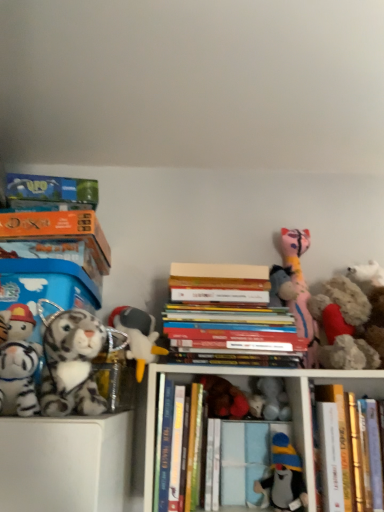
At what (x,y) coordinates should I click in order to perform the action: click on velvet plush bear at center, arranged as the sixth toy when viewed from the right. Please return your answer as a coordinate pair (x, y). Looking at the image, I should click on (224, 398).

Find the location of `white plush toy at center-left, the 3th toy when ordered from left to right`. white plush toy at center-left, the 3th toy when ordered from left to right is located at coordinates (137, 336).

Identify the location of white plush tiger at left, which appears as the ninth toy when viewed from the right. Image resolution: width=384 pixels, height=512 pixels. (18, 362).

Locate an element on the screen. The height and width of the screenshot is (512, 384). white plush toy at center, the 5th toy in the left-to-right sequence is located at coordinates (274, 399).

The height and width of the screenshot is (512, 384). Describe the element at coordinates (74, 361) in the screenshot. I see `white plush tiger at left, acting as the eighth toy starting from the right` at that location.

Describe the element at coordinates (289, 401) in the screenshot. I see `hardcover books at center` at that location.

Locate an element on the screen. This screenshot has height=512, width=384. velvet plush bear at center, the 4th toy in the left-to-right sequence is located at coordinates (224, 398).

Is hardcover books at center, which ranks as the 2th book in right-to-left order, inside or outside of fluffy beige stuffed animal at right, the eighth toy when ordered from left to right?

The correct answer is: outside.

Can you tell me how much hardcover books at center, which appears as the third book when viewed from the left, and fluffy beige stuffed animal at right, the eighth toy when ordered from left to right, differ in facing direction?

0.341 degrees separate the facing orientations of hardcover books at center, which appears as the third book when viewed from the left, and fluffy beige stuffed animal at right, the eighth toy when ordered from left to right.

Does hardcover books at center, which appears as the third book when viewed from the left, turn towards fluffy beige stuffed animal at right, the eighth toy when ordered from left to right?

No, hardcover books at center, which appears as the third book when viewed from the left, is not facing towards fluffy beige stuffed animal at right, the eighth toy when ordered from left to right.

From a real-world perspective, between hardcover books at center, which appears as the third book when viewed from the left, and fluffy beige stuffed animal at right, the eighth toy when ordered from left to right, who is vertically higher?

From a 3D spatial view, fluffy beige stuffed animal at right, the eighth toy when ordered from left to right, is above.

From a real-world perspective, which object rests below the other?

hardcover book at center, positioned as the first book in right-to-left order, from a real-world perspective.

How different are the orientations of hardcover book at center, positioned as the first book in right-to-left order, and fluffy white teddy bear at right, the 1th toy when ordered from right to left, in degrees?

→ The angular difference between hardcover book at center, positioned as the first book in right-to-left order, and fluffy white teddy bear at right, the 1th toy when ordered from right to left, is 0.341 degrees.

How much distance is there between hardcover book at center, which is counted as the fourth book, starting from the left, and fluffy white teddy bear at right, placed as the 9th toy when sorted from left to right?

hardcover book at center, which is counted as the fourth book, starting from the left, is 19.68 centimeters from fluffy white teddy bear at right, placed as the 9th toy when sorted from left to right.

Which point is more forward, (342,431) or (376,303)?

Point (342,431)

Image resolution: width=384 pixels, height=512 pixels. I want to click on the 5th toy above the soft plush penguin at center, which is the 4th toy in right-to-left order (from a real-world perspective), so click(137, 336).

Would you consider white plush toy at center-left, the 3th toy when ordered from left to right, to be distant from soft plush penguin at center, the sixth toy viewed from the left?

white plush toy at center-left, the 3th toy when ordered from left to right, is actually quite close to soft plush penguin at center, the sixth toy viewed from the left.

Is white plush toy at center-left, acting as the seventh toy starting from the right, spatially inside soft plush penguin at center, which is the 4th toy in right-to-left order, or outside of it?

The correct answer is: outside.

Considering the relative sizes of velvet plush bear at center, arranged as the sixth toy when viewed from the right, and hardcover books at center, which ranks as the 2th book in right-to-left order, in the image provided, is velvet plush bear at center, arranged as the sixth toy when viewed from the right, smaller than hardcover books at center, which ranks as the 2th book in right-to-left order,?

Yes.

Is velvet plush bear at center, arranged as the sixth toy when viewed from the right, not near hardcover books at center, which ranks as the 2th book in right-to-left order?

Actually, velvet plush bear at center, arranged as the sixth toy when viewed from the right, and hardcover books at center, which ranks as the 2th book in right-to-left order, are a little close together.

From the image's perspective, who appears lower, velvet plush bear at center, the 4th toy in the left-to-right sequence, or hardcover books at center, which ranks as the 2th book in right-to-left order?

From the image's view, velvet plush bear at center, the 4th toy in the left-to-right sequence, is below.

Between velvet plush bear at center, the 4th toy in the left-to-right sequence, and hardcover books at center, which ranks as the 2th book in right-to-left order, which one has less height?

Standing shorter between the two is velvet plush bear at center, the 4th toy in the left-to-right sequence.

Is hardcover book at center, positioned as the first book in right-to-left order, at the right side of white plush toy at center-left, acting as the seventh toy starting from the right?

Yes.

Is hardcover book at center, positioned as the first book in right-to-left order, not inside white plush toy at center-left, acting as the seventh toy starting from the right?

Indeed, hardcover book at center, positioned as the first book in right-to-left order, is completely outside white plush toy at center-left, acting as the seventh toy starting from the right.

Is hardcover book at center, positioned as the first book in right-to-left order, positioned far away from white plush toy at center-left, the 3th toy when ordered from left to right?

No, hardcover book at center, positioned as the first book in right-to-left order, is in close proximity to white plush toy at center-left, the 3th toy when ordered from left to right.

Is hardcover book at center, positioned as the first book in right-to-left order, turned away from white plush toy at center-left, the 3th toy when ordered from left to right?

No.

Is matte pink plush cat at upper right, placed as the 3th toy when sorted from right to left, oriented away from white plush tiger at left, acting as the eighth toy starting from the right?

No, matte pink plush cat at upper right, placed as the 3th toy when sorted from right to left,'s orientation is not away from white plush tiger at left, acting as the eighth toy starting from the right.

Is matte pink plush cat at upper right, the seventh toy viewed from the left, taller or shorter than white plush tiger at left, acting as the eighth toy starting from the right?

In the image, matte pink plush cat at upper right, the seventh toy viewed from the left, appears to be taller than white plush tiger at left, acting as the eighth toy starting from the right.

Looking at this image, from a real-world perspective, between matte pink plush cat at upper right, the seventh toy viewed from the left, and white plush tiger at left, which ranks as the 2th toy in left-to-right order, who is vertically higher?

matte pink plush cat at upper right, the seventh toy viewed from the left.

Is hardcover books at center, which appears as the third book when viewed from the left, situated inside velvet plush bear at center, the 4th toy in the left-to-right sequence, or outside?

The correct answer is: outside.

How different are the orientations of hardcover books at center, which appears as the third book when viewed from the left, and velvet plush bear at center, the 4th toy in the left-to-right sequence, in degrees?

The facing directions of hardcover books at center, which appears as the third book when viewed from the left, and velvet plush bear at center, the 4th toy in the left-to-right sequence, are 0.000658 degrees apart.

Considering the positions of objects hardcover books at center, which ranks as the 2th book in right-to-left order, and velvet plush bear at center, arranged as the sixth toy when viewed from the right, in the image provided, who is more to the right, hardcover books at center, which ranks as the 2th book in right-to-left order, or velvet plush bear at center, arranged as the sixth toy when viewed from the right,?

Positioned to the right is hardcover books at center, which ranks as the 2th book in right-to-left order.

From the image's perspective, is hardcover books at center, which ranks as the 2th book in right-to-left order, located above velvet plush bear at center, the 4th toy in the left-to-right sequence?

Yes, from the image's perspective, hardcover books at center, which ranks as the 2th book in right-to-left order, is over velvet plush bear at center, the 4th toy in the left-to-right sequence.

The height and width of the screenshot is (512, 384). Identify the location of the 1st toy positioned above the hardcover books at center, which ranks as the 2th book in right-to-left order (from a real-world perspective). (343, 325).

I want to click on book that is the 3rd one when counting forward from the fluffy white teddy bear at right, the 1th toy when ordered from right to left, so click(339, 430).

When comparing their distances from fluffy white teddy bear at right, the 1th toy when ordered from right to left, does hardcover books at center or fluffy beige stuffed animal at right, the eighth toy when ordered from left to right, seem closer?

Based on the image, fluffy beige stuffed animal at right, the eighth toy when ordered from left to right, appears to be nearer to fluffy white teddy bear at right, the 1th toy when ordered from right to left.

Estimate the real-world distances between objects in this image. Which object is closer to hardcover book at center, the 2th book viewed from the left, hardcover books at center, which appears as the third book when viewed from the left, or white plush tiger at left, acting as the eighth toy starting from the right?

hardcover books at center, which appears as the third book when viewed from the left, is positioned closer to the anchor hardcover book at center, the 2th book viewed from the left.

Which object lies further to the anchor point hardcover books at center, which ranks as the 2th book in right-to-left order, white plush tiger at left, acting as the eighth toy starting from the right, or matte pink plush cat at upper right, placed as the 3th toy when sorted from right to left?

white plush tiger at left, acting as the eighth toy starting from the right.

When comparing their distances from white plush tiger at left, acting as the eighth toy starting from the right, does soft plush penguin at center, which is the 4th toy in right-to-left order, or white plush tiger at left, which appears as the ninth toy when viewed from the right, seem closer?

Among the two, white plush tiger at left, which appears as the ninth toy when viewed from the right, is located nearer to white plush tiger at left, acting as the eighth toy starting from the right.

Based on the photo, when comparing their distances from hardcover books at center, does soft plush penguin at center, the sixth toy viewed from the left, or white plush toy at center-left, acting as the seventh toy starting from the right, seem closer?

Based on the image, soft plush penguin at center, the sixth toy viewed from the left, appears to be nearer to hardcover books at center.

From the image, which object appears to be farther from hardcover book at center, which is counted as the fourth book, starting from the left, orange cardboard book at left, which is the first book in left-to-right order, or matte pink plush cat at upper right, the seventh toy viewed from the left?

Based on the image, orange cardboard book at left, which is the first book in left-to-right order, appears to be further to hardcover book at center, which is counted as the fourth book, starting from the left.

Looking at the image, which one is located further to orange cardboard book at left, which is the 4th book in right-to-left order, hardcover book at center, positioned as the first book in right-to-left order, or white plush tiger at left, which ranks as the 2th toy in left-to-right order?

Based on the image, hardcover book at center, positioned as the first book in right-to-left order, appears to be further to orange cardboard book at left, which is the 4th book in right-to-left order.

Considering their positions, is orange cardboard book at left, which is the first book in left-to-right order, positioned further to matte pink plush cat at upper right, placed as the 3th toy when sorted from right to left, than hardcover books at center?

orange cardboard book at left, which is the first book in left-to-right order, lies further to matte pink plush cat at upper right, placed as the 3th toy when sorted from right to left, than the other object.

I want to click on shelf between hardcover book at center, the 2th book viewed from the left, and hardcover book at center, which is counted as the fourth book, starting from the left, so click(289, 401).

Find the location of `book between matte pink plush cat at upper right, placed as the 3th toy when sorted from right to left, and white plush toy at center, marked as the fifth toy in a right-to-left arrangement, in the vertical direction`. book between matte pink plush cat at upper right, placed as the 3th toy when sorted from right to left, and white plush toy at center, marked as the fifth toy in a right-to-left arrangement, in the vertical direction is located at coordinates (228, 314).

Find the location of a particular element. The height and width of the screenshot is (512, 384). book between orange cardboard book at left, which is the first book in left-to-right order, and hardcover books at center, which appears as the third book when viewed from the left, in the horizontal direction is located at coordinates pos(183,452).

The width and height of the screenshot is (384, 512). I want to click on book between hardcover books at center, which appears as the third book when viewed from the left, and hardcover books at center in the up-down direction, so click(x=183, y=452).